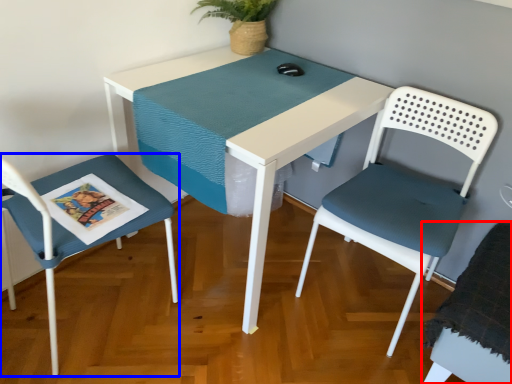
Question: Among these objects, which one is nearest to the camera, chair (highlighted by a red box) or chair (highlighted by a blue box)?

Choices:
 (A) chair
 (B) chair

Answer: (B)